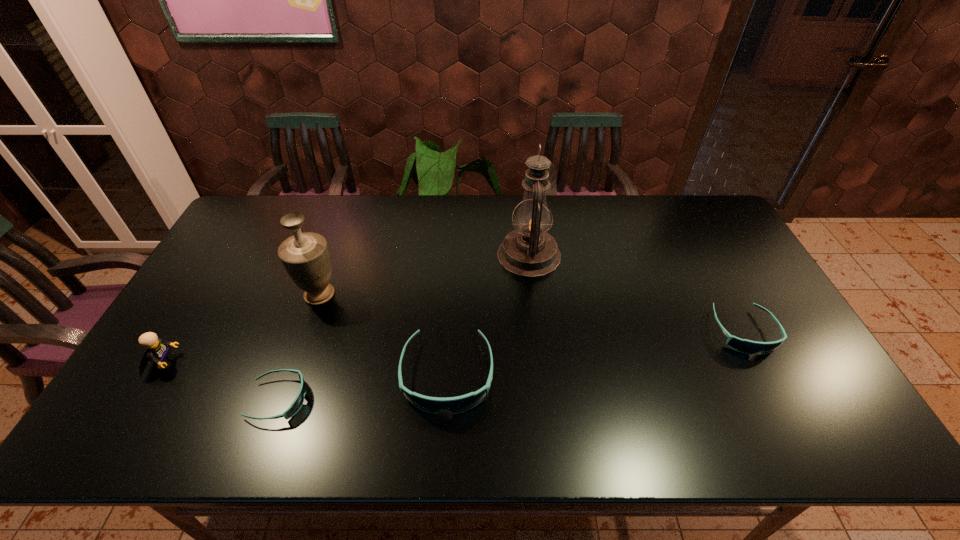
Please point a spot to place another sunglasses for symmetrical spacing. Please provide its 2D coordinates. Your answer should be formatted as a tuple, i.e. [(x, y)], where the tuple contains the x and y coordinates of a point satisfying the conditions above.

[(602, 352)]